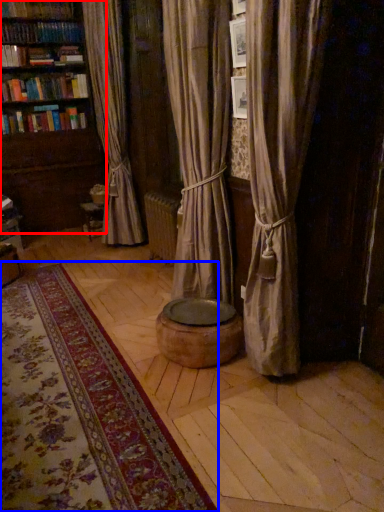
Question: Which point is closer to the camera, bookcase (highlighted by a red box) or mat (highlighted by a blue box)?

Choices:
 (A) bookcase
 (B) mat

Answer: (B)